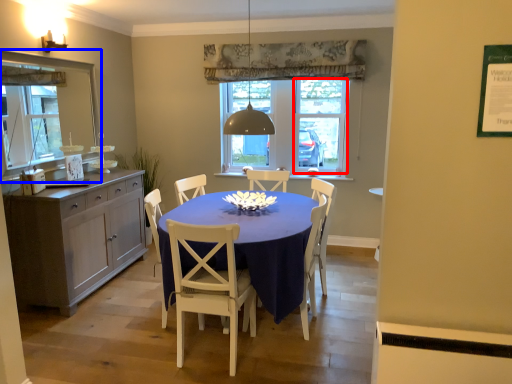
Question: Among these objects, which one is farthest to the camera, glass door (highlighted by a red box) or mirror (highlighted by a blue box)?

Choices:
 (A) glass door
 (B) mirror

Answer: (A)